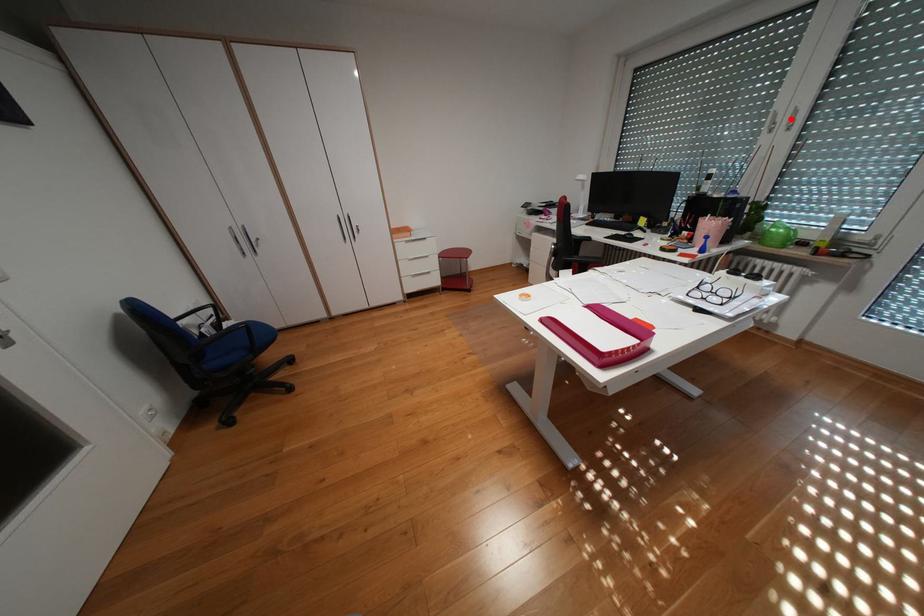
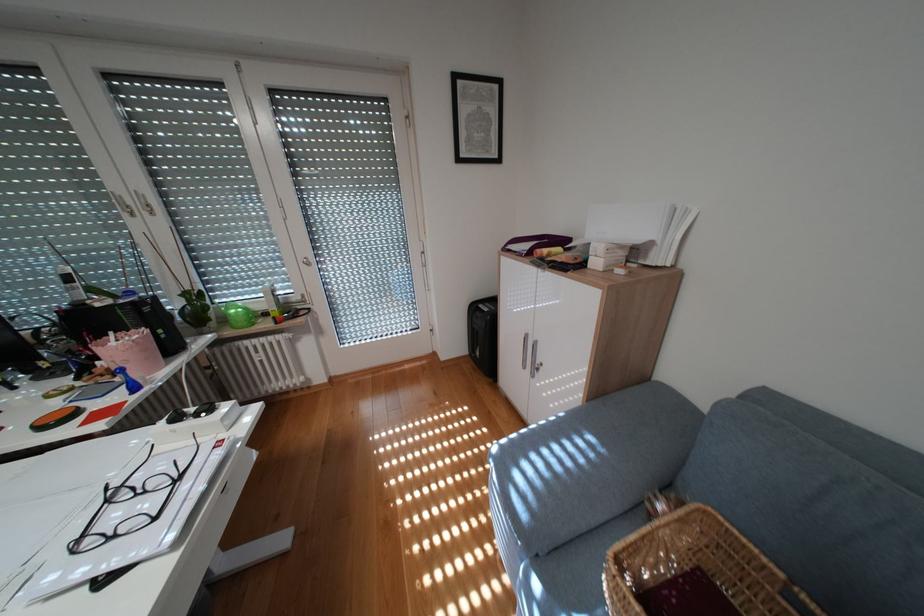
Where in the second image is the point corresponding to the highlighted location from the first image?

(141, 201)